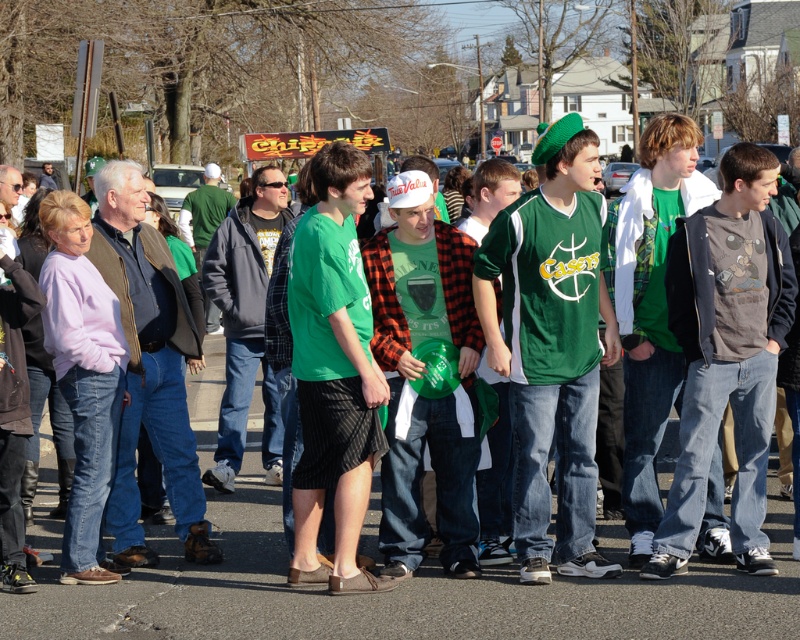
Based on the scene description, where exactly is the green jersey at center located in terms of coordinates?

The green jersey at center is located at coordinates point (552, 348).

You are a photographer trying to capture a clear photo of the green plaid shirt at center and the green matte shirt at center. Since both are in the same area, which one is closer to the camera?

The green plaid shirt at center is in front of the green matte shirt at center, so it is closer to the camera.

You are standing at the center of the image and see a point marked at coordinates (552, 348). What object is this point located on?

The point at coordinates (552, 348) is located on the green jersey at center.